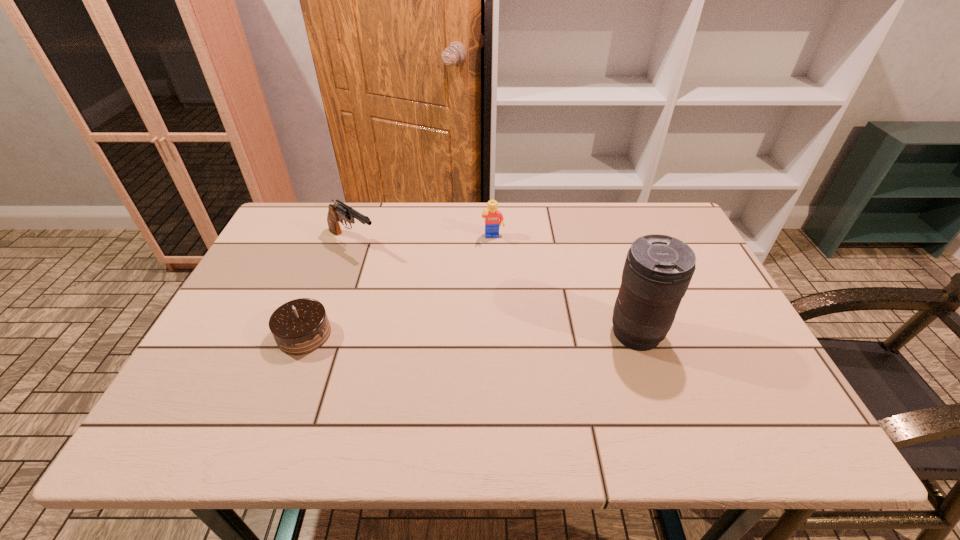
This screenshot has height=540, width=960. Find the location of `free space between the gun and the chocolate cake`. free space between the gun and the chocolate cake is located at coordinates (328, 288).

Where is `free spot between the shortest object and the gun`? The width and height of the screenshot is (960, 540). free spot between the shortest object and the gun is located at coordinates (328, 288).

Locate an element on the screen. The width and height of the screenshot is (960, 540). vacant area that lies between the second object from right to left and the chocolate cake is located at coordinates (398, 286).

Locate an element on the screen. The width and height of the screenshot is (960, 540). empty space that is in between the rightmost object and the gun is located at coordinates (494, 288).

The height and width of the screenshot is (540, 960). I want to click on free space between the gun and the third object from left to right, so click(x=422, y=240).

Locate an element on the screen. The height and width of the screenshot is (540, 960). the second closest object to the shortest object is located at coordinates coord(492,215).

This screenshot has width=960, height=540. I want to click on object that is the third closest to the gun, so click(658, 269).

Image resolution: width=960 pixels, height=540 pixels. What are the coordinates of `vacant area that satisfies the following two spatial constraints: 1. on the front side of the telephoto lens; 2. on the side of the third object from left to right where the control switches are located` in the screenshot? It's located at (496, 333).

This screenshot has height=540, width=960. I want to click on vacant space that satisfies the following two spatial constraints: 1. on the back side of the tallest object; 2. on the side of the shortest object where the control switches are located, so click(x=304, y=333).